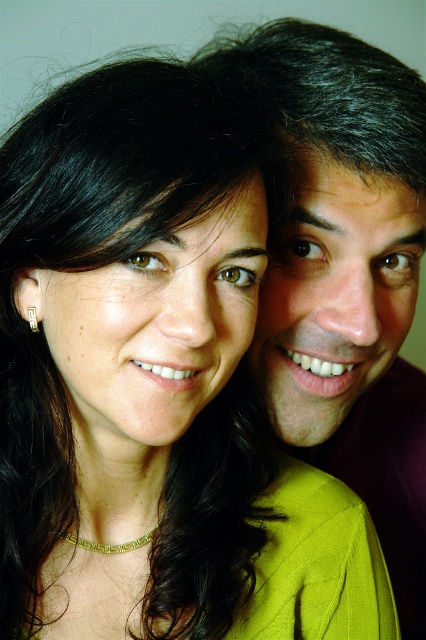
Is point (138, 538) positioned before point (28, 308)?

No, it is not.

Which is behind, point (80, 538) or point (28, 307)?

Positioned behind is point (80, 538).

Locate an element on the screen. This screenshot has width=426, height=640. gold textured necklace at lower center is located at coordinates (109, 545).

Locate an element on the screen. This screenshot has height=640, width=426. gold textured necklace at lower center is located at coordinates coord(109,545).